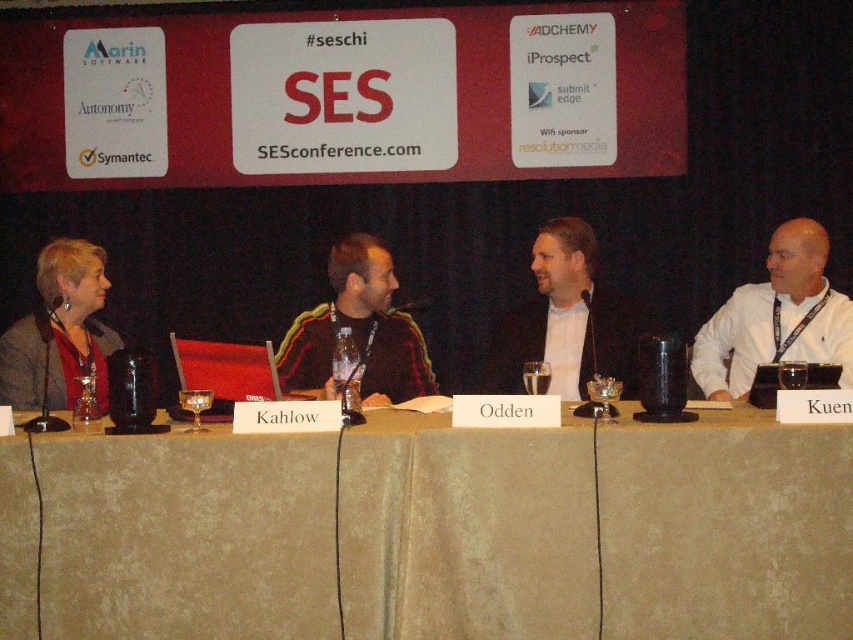
Question: Can you confirm if beige fabric table at center is positioned above dark red fabric jacket at center?

Choices:
 (A) yes
 (B) no

Answer: (B)

Question: Is white shirt at right bigger than dark red fabric jacket at center?

Choices:
 (A) no
 (B) yes

Answer: (B)

Question: Can you confirm if white shirt at right is positioned to the left of dark red fabric jacket at center?

Choices:
 (A) no
 (B) yes

Answer: (A)

Question: Which of the following is the farthest from the observer?

Choices:
 (A) matte black suit at center
 (B) white shirt at right

Answer: (B)

Question: Which object appears closest to the camera in this image?

Choices:
 (A) white shirt at right
 (B) matte black suit at center

Answer: (B)

Question: Estimate the real-world distances between objects in this image. Which object is farther from the beige fabric table at center?

Choices:
 (A) matte black jacket at left
 (B) white shirt at right
 (C) matte black suit at center

Answer: (B)